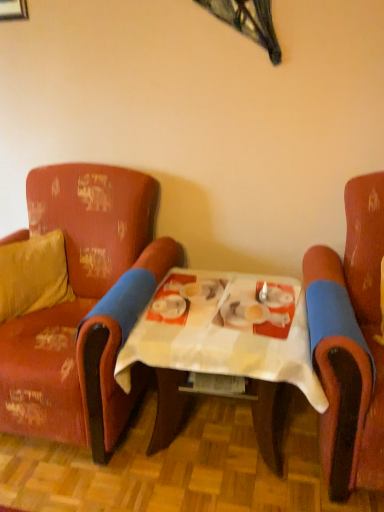
Question: From the image's perspective, is distressed red fabric armchair at left, the first chair in the left-to-right sequence, on top of scratched leather armchair at right, marked as the 2th chair in a left-to-right arrangement?

Choices:
 (A) no
 (B) yes

Answer: (B)

Question: Does distressed red fabric armchair at left, which appears as the second chair when viewed from the right, have a lesser width compared to scratched leather armchair at right, placed as the 1th chair when sorted from right to left?

Choices:
 (A) no
 (B) yes

Answer: (B)

Question: Is distressed red fabric armchair at left, which appears as the second chair when viewed from the right, further to camera compared to scratched leather armchair at right, placed as the 1th chair when sorted from right to left?

Choices:
 (A) yes
 (B) no

Answer: (A)

Question: From a real-world perspective, is distressed red fabric armchair at left, which appears as the second chair when viewed from the right, under scratched leather armchair at right, placed as the 1th chair when sorted from right to left?

Choices:
 (A) yes
 (B) no

Answer: (A)

Question: Is distressed red fabric armchair at left, which appears as the second chair when viewed from the right, oriented towards scratched leather armchair at right, placed as the 1th chair when sorted from right to left?

Choices:
 (A) yes
 (B) no

Answer: (B)

Question: From the image's perspective, relative to velvet yellow pillow at left, is distressed red fabric armchair at left, which appears as the second chair when viewed from the right, above or below?

Choices:
 (A) below
 (B) above

Answer: (A)

Question: Is distressed red fabric armchair at left, the first chair in the left-to-right sequence, taller or shorter than velvet yellow pillow at left?

Choices:
 (A) tall
 (B) short

Answer: (A)

Question: From a real-world perspective, is distressed red fabric armchair at left, the first chair in the left-to-right sequence, physically located above or below velvet yellow pillow at left?

Choices:
 (A) below
 (B) above

Answer: (A)

Question: Visually, is distressed red fabric armchair at left, which appears as the second chair when viewed from the right, positioned to the left or to the right of velvet yellow pillow at left?

Choices:
 (A) right
 (B) left

Answer: (A)

Question: Would you say white checkered table at center is to the left or to the right of scratched leather armchair at right, marked as the 2th chair in a left-to-right arrangement, in the picture?

Choices:
 (A) left
 (B) right

Answer: (A)

Question: From a real-world perspective, is white checkered table at center physically located above or below scratched leather armchair at right, placed as the 1th chair when sorted from right to left?

Choices:
 (A) above
 (B) below

Answer: (B)

Question: In terms of width, does white checkered table at center look wider or thinner when compared to scratched leather armchair at right, placed as the 1th chair when sorted from right to left?

Choices:
 (A) wide
 (B) thin

Answer: (B)

Question: Considering the positions of white checkered table at center and scratched leather armchair at right, marked as the 2th chair in a left-to-right arrangement, in the image, is white checkered table at center bigger or smaller than scratched leather armchair at right, marked as the 2th chair in a left-to-right arrangement,?

Choices:
 (A) big
 (B) small

Answer: (B)

Question: Is scratched leather armchair at right, placed as the 1th chair when sorted from right to left, inside or outside of velvet yellow pillow at left?

Choices:
 (A) inside
 (B) outside

Answer: (B)

Question: Is point (380, 184) closer or farther from the camera than point (51, 293)?

Choices:
 (A) farther
 (B) closer

Answer: (B)